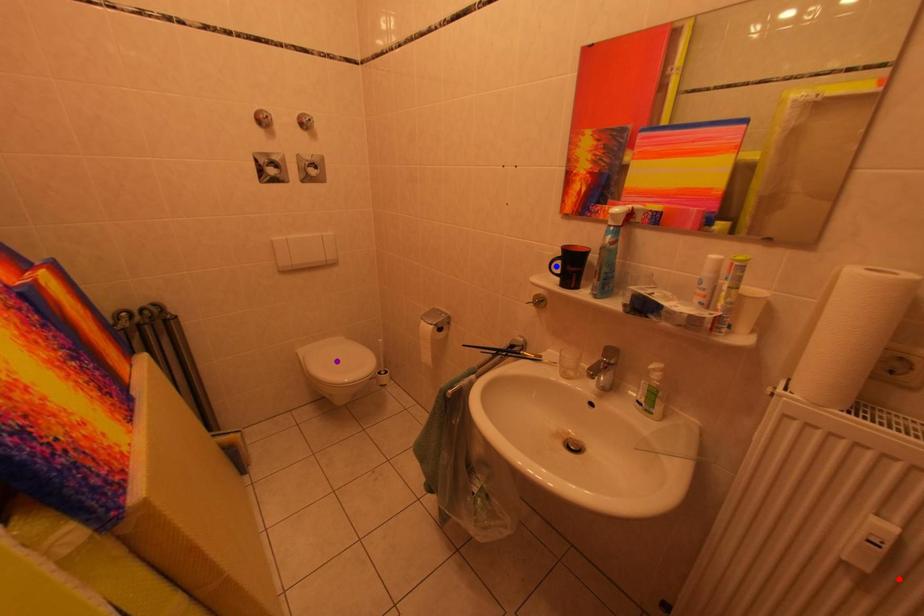
Order these from nearest to farthest:
red point | purple point | blue point

purple point < blue point < red point